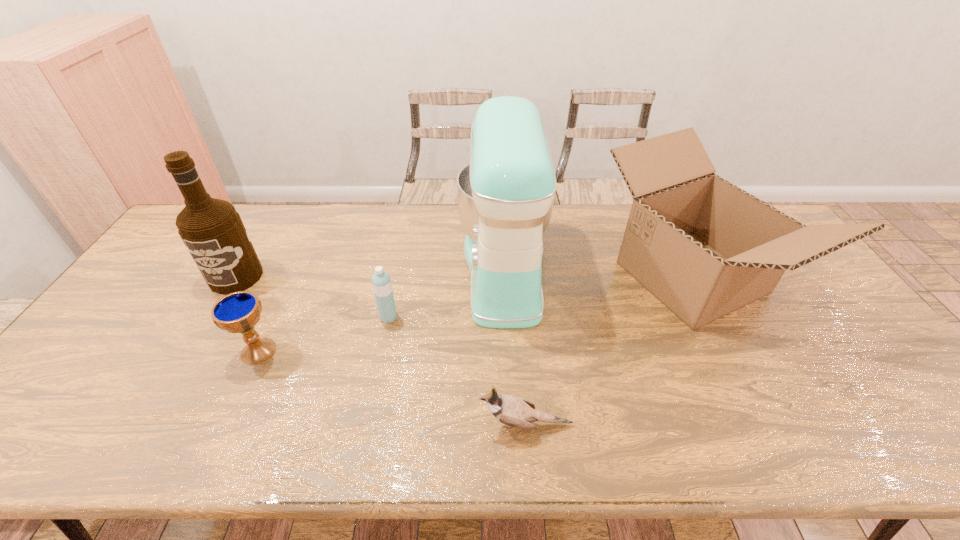
Find the location of a particular element. The height and width of the screenshot is (540, 960). object that is at the near edge is located at coordinates (514, 411).

The width and height of the screenshot is (960, 540). Find the location of `object situated at the right edge`. object situated at the right edge is located at coordinates [704, 247].

I want to click on object at the far right corner, so click(704, 247).

You are a GUI agent. You are given a task and a screenshot of the screen. Output one action in this format:
    pyautogui.click(x=<x>, y=<y>)
    Task: Click on the vacant region at the far edge of the desktop
    
    Given the screenshot: What is the action you would take?
    pyautogui.click(x=401, y=244)

In the image, there is a desktop. At what (x,y) coordinates should I click in order to perform the action: click on vacant space at the near edge. Please return your answer as a coordinate pair (x, y). This screenshot has height=540, width=960. Looking at the image, I should click on (332, 453).

Find the location of a particular element. The height and width of the screenshot is (540, 960). free space at the left edge is located at coordinates (101, 375).

Where is `unoccupied area between the leftmost object and the box`? unoccupied area between the leftmost object and the box is located at coordinates (464, 277).

The width and height of the screenshot is (960, 540). What are the coordinates of `vacant region between the mixer and the water bottle` in the screenshot? It's located at (446, 294).

At what (x,y) coordinates should I click in order to perform the action: click on vacant area that lies between the box and the mixer. Please return your answer as a coordinate pair (x, y). The width and height of the screenshot is (960, 540). Looking at the image, I should click on pyautogui.click(x=598, y=274).

The image size is (960, 540). In order to click on free area in between the mixer and the nearest object in this screenshot , I will do `click(515, 348)`.